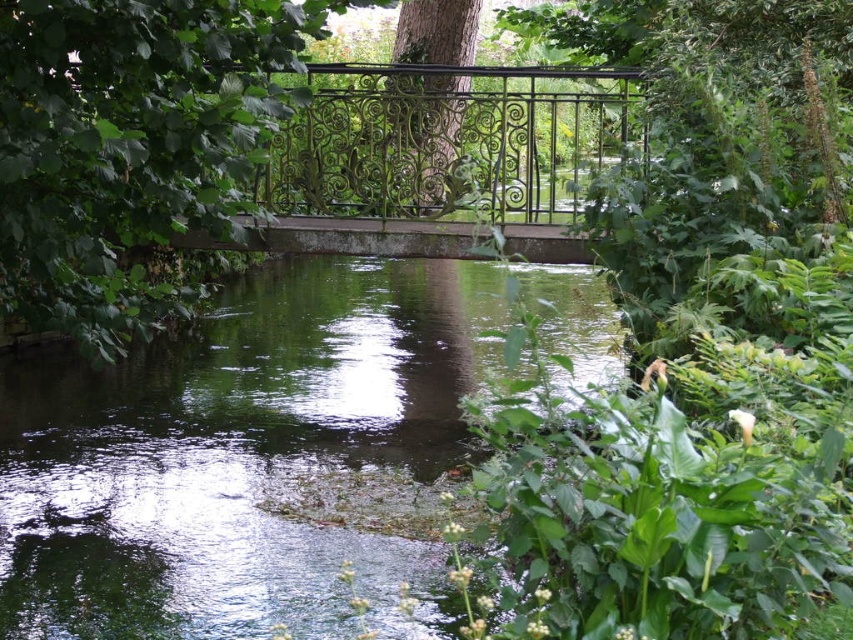
Question: From the image, what is the correct spatial relationship of green leafy tree at center in relation to green wrought iron railing at center?

Choices:
 (A) right
 (B) left

Answer: (B)

Question: Which point is farther from the camera taking this photo?

Choices:
 (A) (216, 120)
 (B) (764, 24)
 (C) (390, 104)

Answer: (C)

Question: Is green leafy tree at center smaller than green matte tree at center?

Choices:
 (A) no
 (B) yes

Answer: (A)

Question: Is green leafy plant at center below green leafy tree at center?

Choices:
 (A) yes
 (B) no

Answer: (B)

Question: Among these points, which one is nearest to the camera?

Choices:
 (A) (531, 125)
 (B) (326, 8)

Answer: (B)

Question: Which point is farther to the camera?

Choices:
 (A) green leafy tree at center
 (B) green leafy plant at center
 (C) green matte tree at center
 (D) green wrought iron railing at center

Answer: (C)